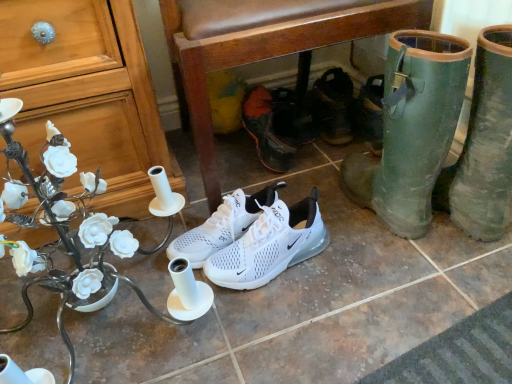
Locate an element on the screen. vacant space in front of green rubber boots at lower right, the first footwear from the front is located at coordinates point(400,281).